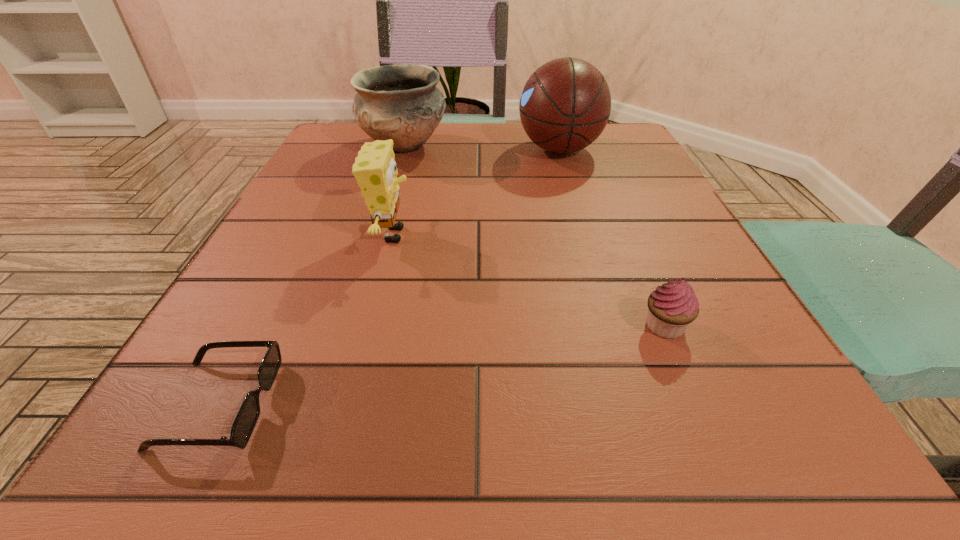
At what (x,y) coordinates should I click in order to perform the action: click on object that is at the near left corner. Please return your answer as a coordinate pair (x, y). This screenshot has width=960, height=540. Looking at the image, I should click on (247, 417).

Identify the location of object positioned at the far right corner. Image resolution: width=960 pixels, height=540 pixels. (565, 105).

The height and width of the screenshot is (540, 960). Identify the location of free space at the far edge of the desktop. (453, 136).

This screenshot has width=960, height=540. In order to click on free space at the near edge in this screenshot , I will do `click(483, 472)`.

The height and width of the screenshot is (540, 960). What are the coordinates of `vacant area at the left edge` in the screenshot? It's located at (277, 253).

Find the location of a particular element. The image size is (960, 540). free space at the right edge of the desktop is located at coordinates (660, 275).

Image resolution: width=960 pixels, height=540 pixels. Identify the location of vacant area at the far left corner. (350, 147).

In order to click on vacant space at the near left corner of the desktop in this screenshot , I will do `click(283, 434)`.

At what (x,y) coordinates should I click in order to perform the action: click on free space at the far right corner of the desktop. Please return your answer as a coordinate pair (x, y). The image size is (960, 540). Looking at the image, I should click on (622, 136).

Locate an element on the screen. free spot between the pottery and the third farthest object is located at coordinates (398, 190).